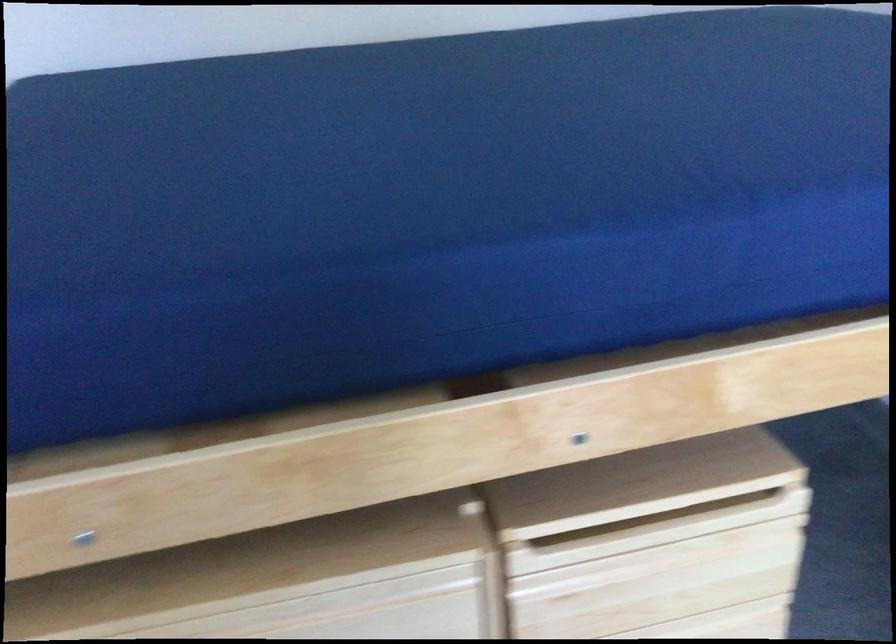
Find the location of a particular element. This screenshot has height=644, width=896. sofa sitting surface is located at coordinates (431, 210).